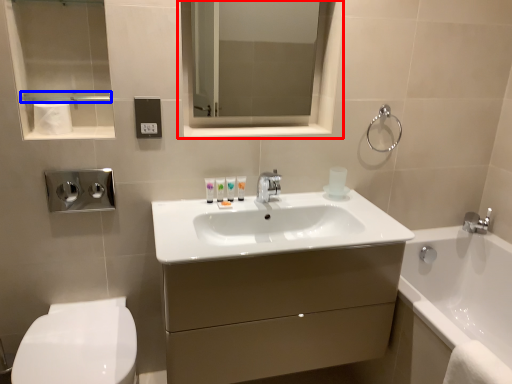
Question: Which point is further to the camera, medicine cabinet (highlighted by a red box) or balustrade (highlighted by a blue box)?

Choices:
 (A) medicine cabinet
 (B) balustrade

Answer: (A)